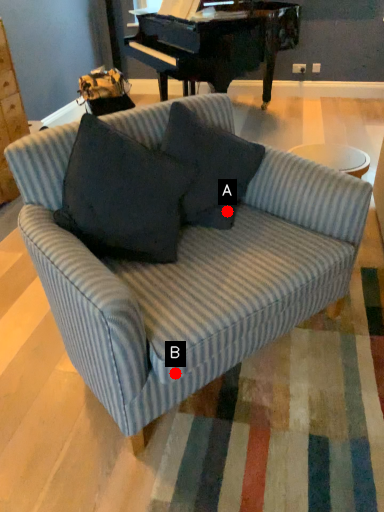
Question: Two points are circled on the image, labeled by A and B beside each circle. Which point appears farthest from the camera in this image?

Choices:
 (A) A is further
 (B) B is further

Answer: (A)